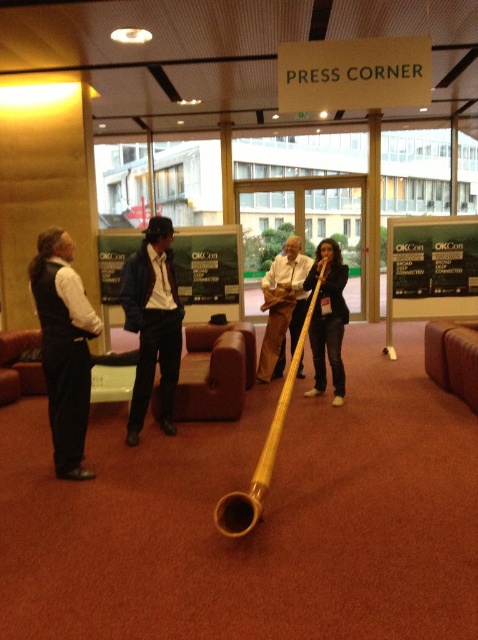
Question: From the image, what is the correct spatial relationship of matte black vest at left in relation to wooden pipe at center?

Choices:
 (A) above
 (B) below

Answer: (B)

Question: Which point is closer to the camera?

Choices:
 (A) natural wood pipe at center
 (B) matte black vest at left

Answer: (A)

Question: Is black glossy bulletin board at center below natural wood pipe at center?

Choices:
 (A) yes
 (B) no

Answer: (B)

Question: Which object is farther from the camera taking this photo?

Choices:
 (A) wooden pipe at center
 (B) dark blue leather jacket at center

Answer: (A)

Question: Which point is farther from the camera taking this photo?

Choices:
 (A) tap(325, 308)
 (B) tap(206, 284)
 (C) tap(281, 292)

Answer: (B)

Question: Is black glossy bulletin board at center positioned before wooden pipe at center?

Choices:
 (A) yes
 (B) no

Answer: (B)